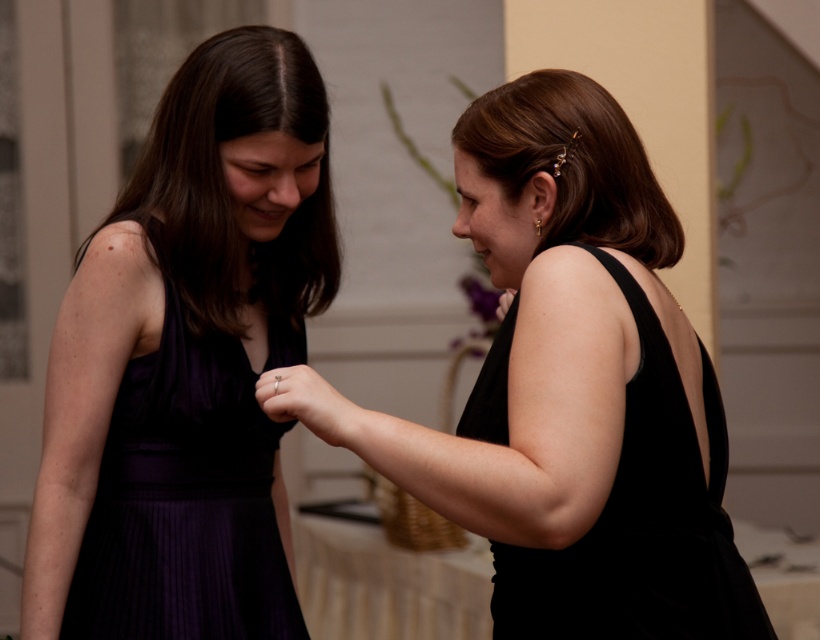
Question: Which point is farther from the camera taking this photo?

Choices:
 (A) (536, 120)
 (B) (595, 458)
 (C) (299, 72)
 (D) (278, 378)

Answer: (C)

Question: Is black satin dress at right in front of shiny gold hairpin at right?

Choices:
 (A) yes
 (B) no

Answer: (A)

Question: Which of these objects is positioned farthest from the black satin dress at right?

Choices:
 (A) matte purple dress at left
 (B) black velvet dress at center
 (C) shiny gold hairpin at right
 (D) purple satin dress at left

Answer: (A)

Question: From the image, what is the correct spatial relationship of matte purple dress at left in relation to matte black hand at center?

Choices:
 (A) above
 (B) below

Answer: (A)

Question: Does purple satin dress at left have a greater width compared to matte gold ring at center?

Choices:
 (A) yes
 (B) no

Answer: (A)

Question: Which object is closer to the camera taking this photo?

Choices:
 (A) matte gold ring at center
 (B) black satin dress at right
 (C) purple satin dress at left

Answer: (B)